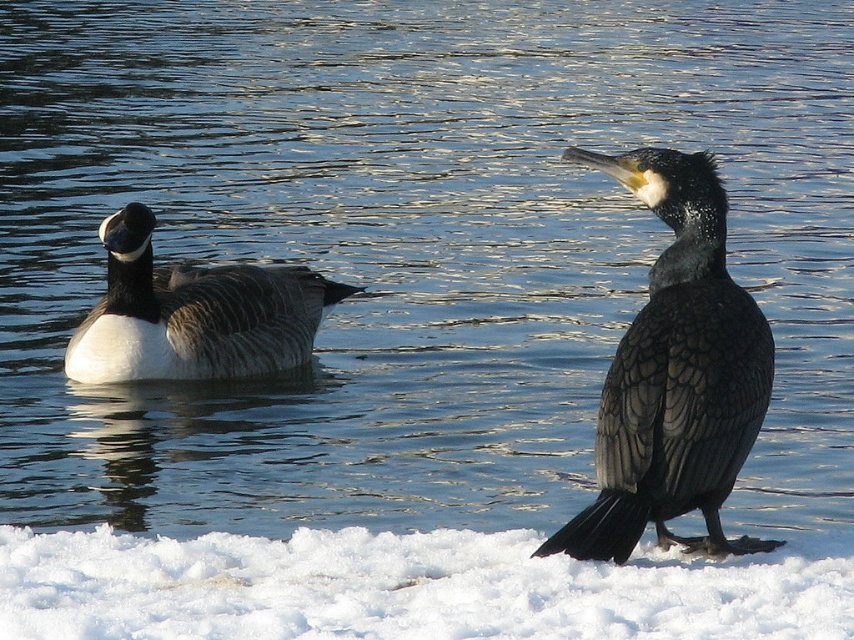
Question: Which object appears farthest from the camera in this image?

Choices:
 (A) dark gray feathers at center
 (B) white fluffy snow at lower center

Answer: (A)

Question: Which point is closer to the camera?

Choices:
 (A) dark gray feathers at center
 (B) white matte duck at left
 (C) white fluffy snow at lower center

Answer: (C)

Question: Estimate the real-world distances between objects in this image. Which object is closer to the white fluffy snow at lower center?

Choices:
 (A) dark gray feathers at center
 (B) white matte duck at left

Answer: (A)

Question: Observing the image, what is the correct spatial positioning of dark gray feathers at center in reference to white matte duck at left?

Choices:
 (A) below
 (B) above

Answer: (A)

Question: Is dark gray feathers at center thinner than white matte duck at left?

Choices:
 (A) no
 (B) yes

Answer: (B)

Question: Is dark gray feathers at center above white matte duck at left?

Choices:
 (A) yes
 (B) no

Answer: (B)